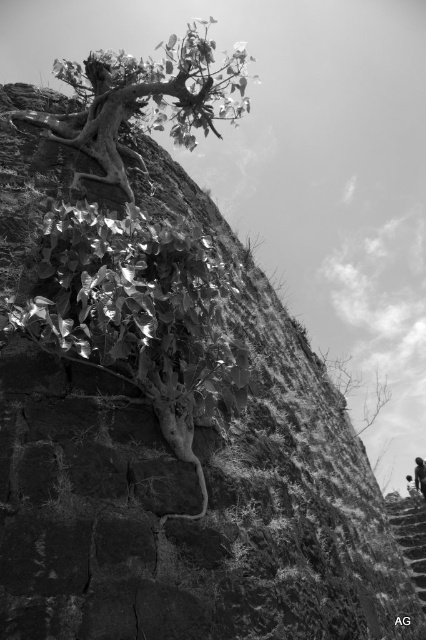
You are an architect designing a garden and want to place a new bench. You have a bench that is 1.2 meters wide. You see the shiny metallic plant at center and the smooth stone stairs at lower right. Can the bench fit between them without overlapping either?

The shiny metallic plant at center is wider than the smooth stone stairs at lower right. Since the bench is 1.2 meters wide, you need to check the distance between them. However, the description only provides their widths, not the space between them. Without knowing the distance between the two objects, it is impossible to determine if the bench will fit.

You are a maintenance worker who needs to reach the shiny metallic plant at center from the smooth stone stairs at lower right. Given that your ladder is 5 meters long, will it be sufficient to bridge the gap between them?

The distance between the shiny metallic plant at center and the smooth stone stairs at lower right is 6.78 meters. Since the ladder is only 5 meters long, it will not be long enough to bridge the gap between them.

You are standing in front of an ancient stone wall with a tree growing out of it. There is a point marked at coordinates (146, 99). What object is located at this point?

The point at coordinates (146, 99) indicates the rough bark tree at upper left.